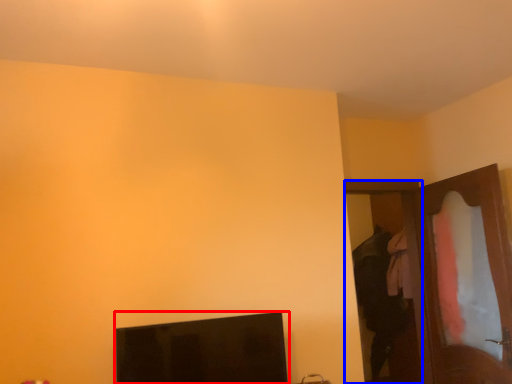
Question: Which of the following is the closest to the observer, computer monitor (highlighted by a red box) or door (highlighted by a blue box)?

Choices:
 (A) computer monitor
 (B) door

Answer: (A)